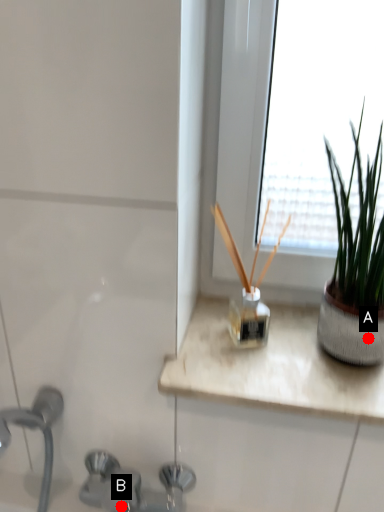
Question: Two points are circled on the image, labeled by A and B beside each circle. Among these points, which one is farthest from the camera?

Choices:
 (A) A is further
 (B) B is further

Answer: (B)